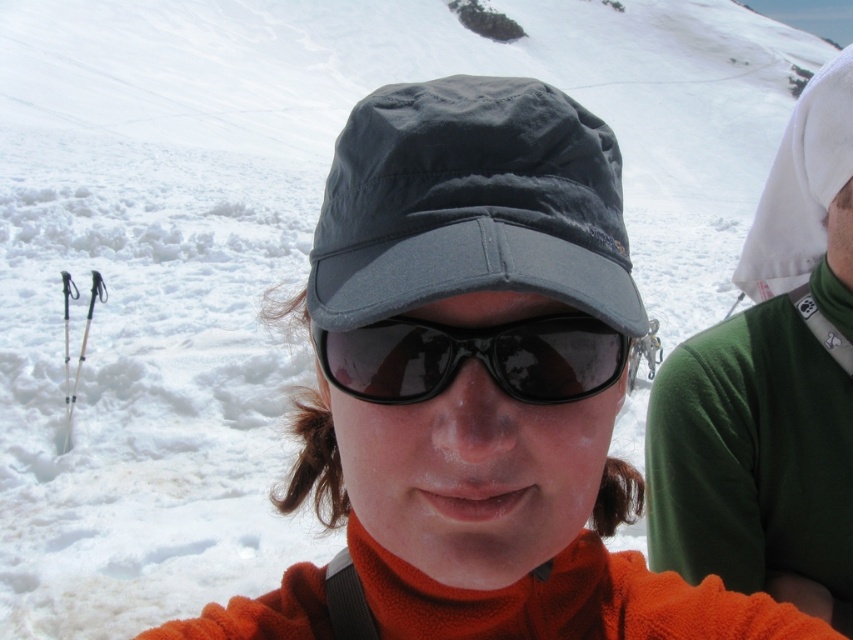
Question: Which point is farther from the camera taking this photo?

Choices:
 (A) tap(839, 305)
 (B) tap(505, 380)

Answer: (A)

Question: Does green fleece sweater at right appear over black matte sunglasses at center?

Choices:
 (A) no
 (B) yes

Answer: (B)

Question: Is green fleece sweater at right closer to the viewer compared to black matte sunglasses at center?

Choices:
 (A) no
 (B) yes

Answer: (A)

Question: Considering the relative positions of green fleece sweater at right and black matte sunglasses at center in the image provided, where is green fleece sweater at right located with respect to black matte sunglasses at center?

Choices:
 (A) above
 (B) below

Answer: (A)

Question: Which point is farther from the camera taking this photo?

Choices:
 (A) (735, 556)
 (B) (462, 336)

Answer: (A)